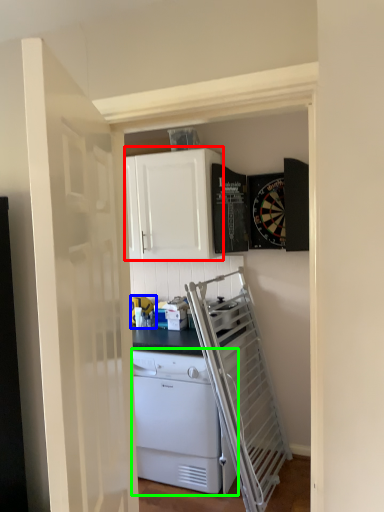
Question: Which object is the closest to the cabinetry (highlighted by a red box)? Choose among these: appliance (highlighted by a blue box) or home appliance (highlighted by a green box).

Choices:
 (A) appliance
 (B) home appliance

Answer: (A)